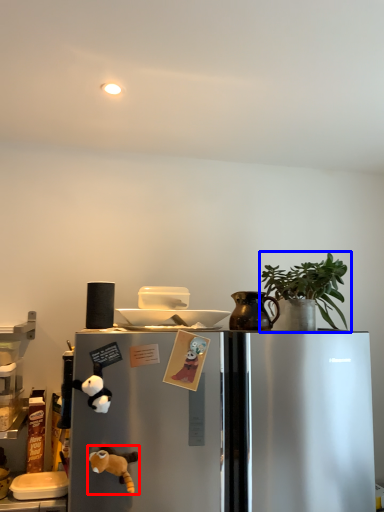
Question: Which object is further to the camera taking this photo, toy (highlighted by a red box) or houseplant (highlighted by a blue box)?

Choices:
 (A) toy
 (B) houseplant

Answer: (B)